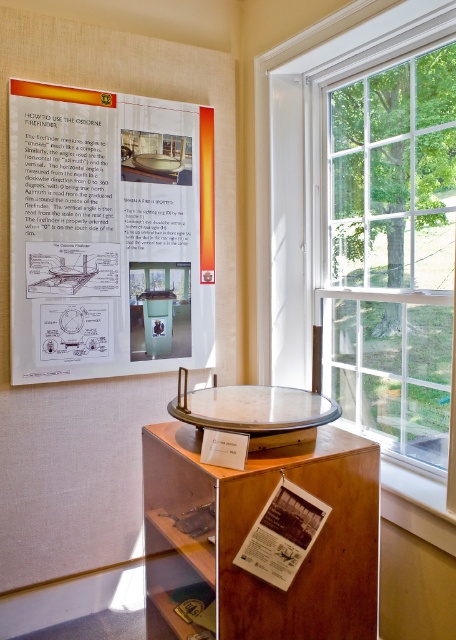
Which is in front, point (376, 284) or point (275, 403)?

Positioned in front is point (275, 403).

Does clear glass window at right appear under metallic polished table at center?

No, clear glass window at right is not below metallic polished table at center.

From the picture: Who is more forward, (373, 273) or (255, 416)?

Positioned in front is point (255, 416).

The height and width of the screenshot is (640, 456). What are the coordinates of `clear glass window at right` in the screenshot? It's located at (368, 225).

Which is behind, point (91, 230) or point (276, 444)?

The point (91, 230) is more distant.

Does white paper poster at upper left have a greater width compared to metallic polished table at center?

Correct, the width of white paper poster at upper left exceeds that of metallic polished table at center.

Locate an element on the screen. The image size is (456, 640). white paper poster at upper left is located at coordinates (108, 234).

You are a GUI agent. You are given a task and a screenshot of the screen. Output one action in this format:
    pyautogui.click(x=<x>, y=<y>)
    Task: Click on the white paper poster at upper left
    
    Given the screenshot: What is the action you would take?
    pyautogui.click(x=108, y=234)

Does white paper poster at upper left have a greater height compared to wooden table at center?

Yes.

Is point (104, 368) positioned after point (295, 508)?

Yes, point (104, 368) is farther from viewer.

Where is `white paper poster at upper left`? This screenshot has height=640, width=456. white paper poster at upper left is located at coordinates (108, 234).